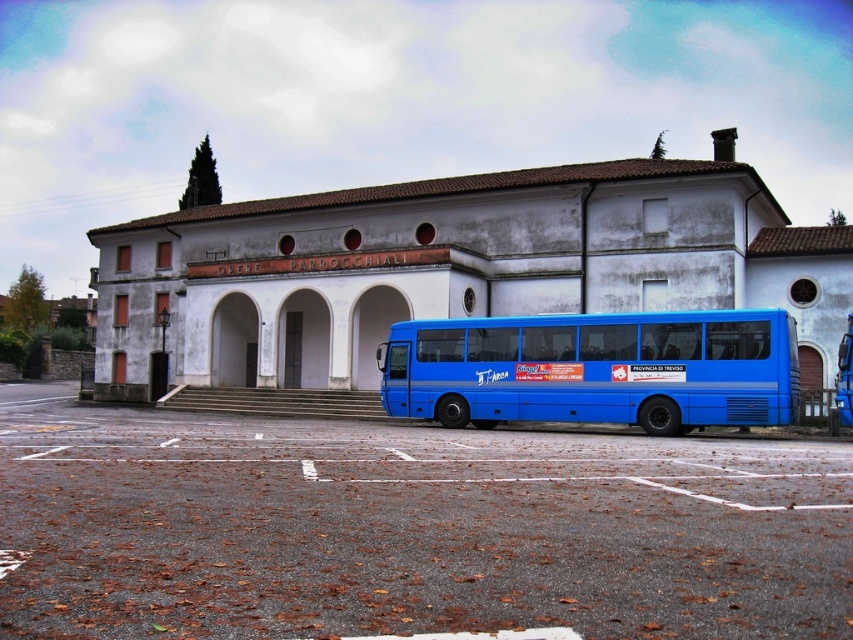
Does smooth asphalt parking lot at center have a smaller size compared to white smooth archway at center?

Incorrect, smooth asphalt parking lot at center is not smaller in size than white smooth archway at center.

Measure the distance between smooth asphalt parking lot at center and camera.

A distance of 4.38 meters exists between smooth asphalt parking lot at center and camera.

The width and height of the screenshot is (853, 640). I want to click on smooth asphalt parking lot at center, so click(x=409, y=529).

Can you confirm if blue metallic bus at center is positioned to the left of white smooth archway at center?

No, blue metallic bus at center is not to the left of white smooth archway at center.

Can you confirm if blue metallic bus at center is shorter than white smooth archway at center?

No.

Locate an element on the screen. The width and height of the screenshot is (853, 640). blue metallic bus at center is located at coordinates [x=596, y=369].

Where is `blue metallic bus at center`? blue metallic bus at center is located at coordinates (596, 369).

Consider the image. Does smooth asphalt parking lot at center appear under blue metallic bus at center?

Indeed, smooth asphalt parking lot at center is positioned under blue metallic bus at center.

Can you confirm if smooth asphalt parking lot at center is positioned to the right of blue metallic bus at center?

Incorrect, smooth asphalt parking lot at center is not on the right side of blue metallic bus at center.

Between point (476, 602) and point (560, 328), which one is positioned behind?

The point (560, 328) is more distant.

Where is `smooth asphalt parking lot at center`? This screenshot has height=640, width=853. smooth asphalt parking lot at center is located at coordinates (409, 529).